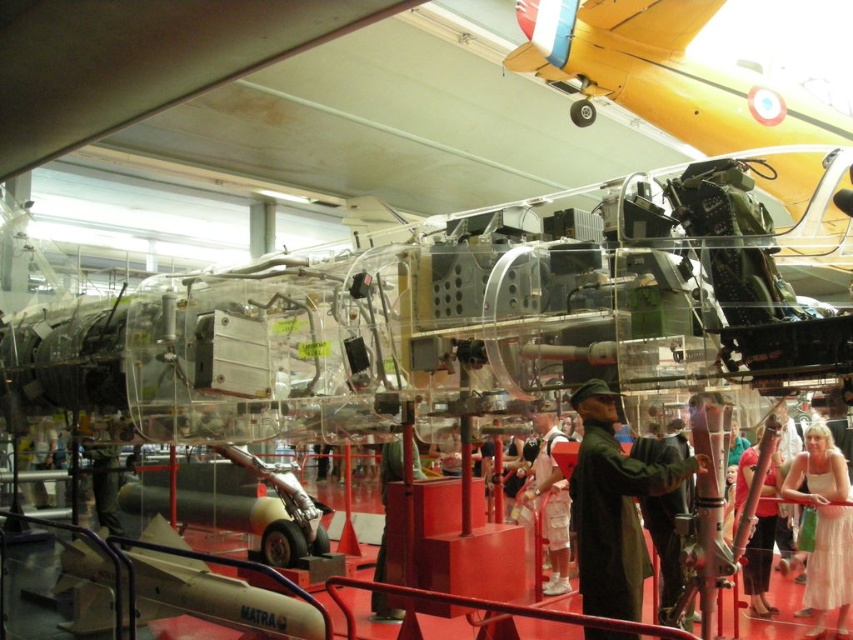
You are a museum visitor who wants to take a photo of the metallic green cockpit at center without the green fabric jacket at center appearing in the frame. Given that your camera has a field of view of 10 feet, can you position yourself in a way that allows you to capture the cockpit while excluding the jacket?

The metallic green cockpit at center and green fabric jacket at center are 10.95 feet apart. Since your camera has a field of view of 10 feet, positioning yourself so that the distance between the two objects exceeds the field of view would allow you to exclude the jacket. By moving 0.95 feet away from the jacket towards the cockpit, the jacket would be just outside the frame, capturing only the cockpit.

You are a visitor in the aviation museum and want to take a photo of the green matte uniform at center and the light brown wooden pole at lower right. Which object should you focus on first if you want to capture both in the same frame without moving the camera?

The green matte uniform at center is above the light brown wooden pole at lower right, so you should focus on the green matte uniform at center first to ensure both are in the frame.